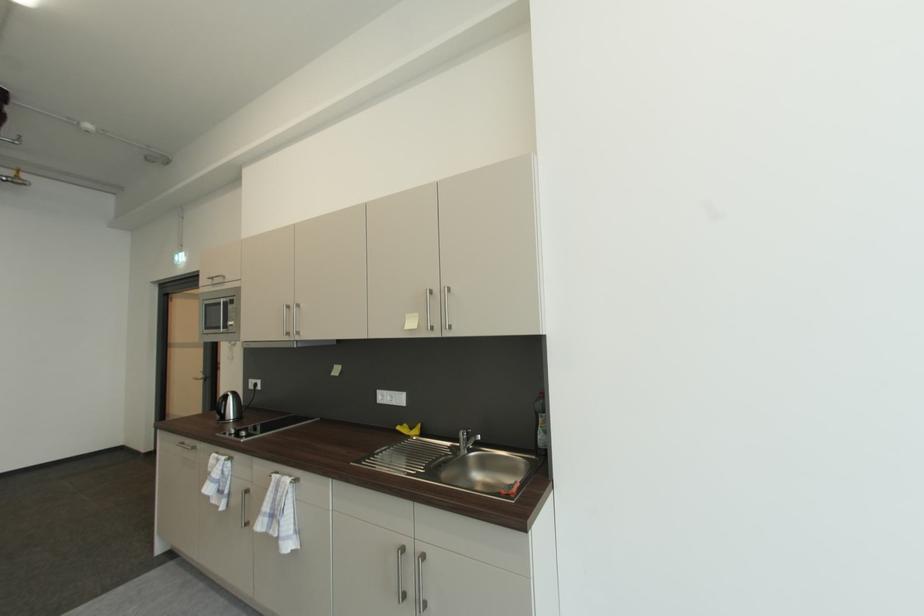
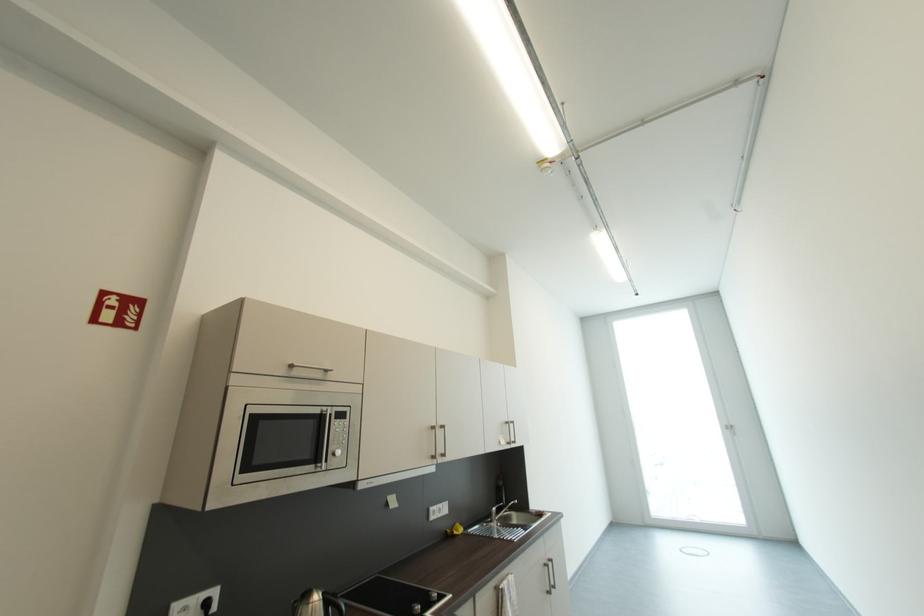
Locate, in the second image, the point that corresponds to (x=409, y=551) in the first image.

(552, 567)